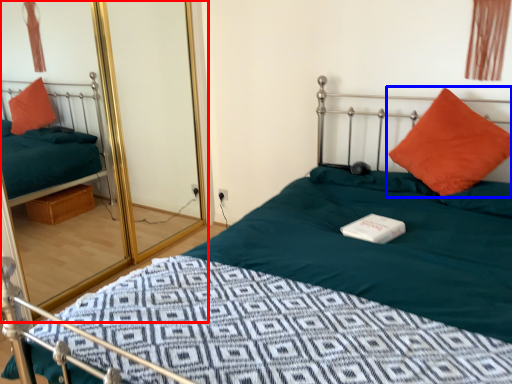
Question: Which object is closer to the camera taking this photo, glass door (highlighted by a red box) or pillow (highlighted by a blue box)?

Choices:
 (A) glass door
 (B) pillow

Answer: (A)